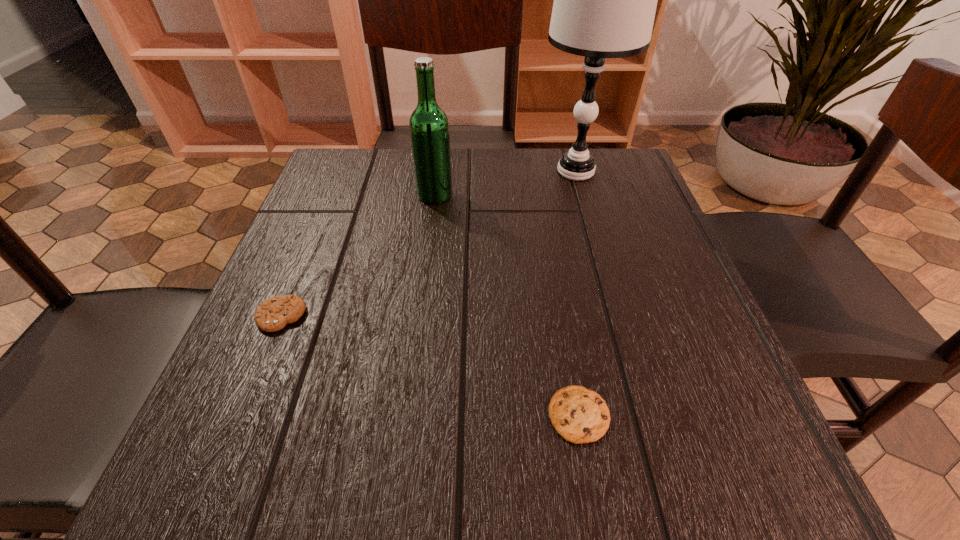
This screenshot has width=960, height=540. What are the coordinates of `the tallest object` in the screenshot? It's located at (605, 0).

Locate an element on the screen. The width and height of the screenshot is (960, 540). the third object from right to left is located at coordinates (429, 128).

The image size is (960, 540). In order to click on beer bottle in this screenshot , I will do `click(429, 128)`.

Where is `the farther cookie`? the farther cookie is located at coordinates (273, 314).

In order to click on the taller cookie in this screenshot , I will do `click(273, 314)`.

Locate an element on the screen. The image size is (960, 540). the right cookie is located at coordinates (578, 414).

This screenshot has width=960, height=540. In order to click on the nearer cookie in this screenshot , I will do `click(578, 414)`.

Where is `blank space located 0.370m on the front of the tallest object`? blank space located 0.370m on the front of the tallest object is located at coordinates (619, 324).

Find the location of a particular element. vacant space located 0.220m on the left of the beer bottle is located at coordinates (319, 195).

This screenshot has height=540, width=960. I want to click on vacant region located 0.100m on the front of the second nearest object, so click(252, 389).